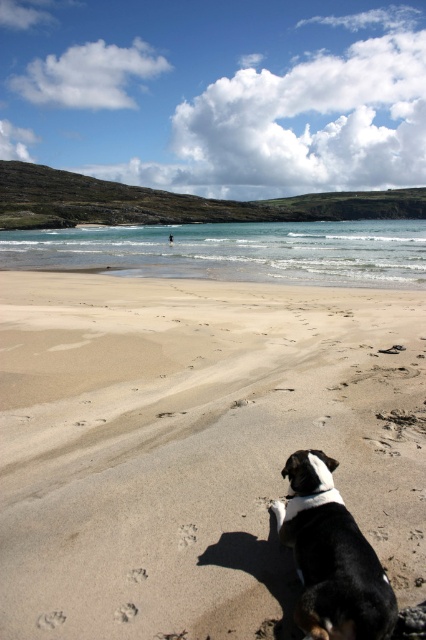
Question: Is sandy beach at lower center below black and white fur at lower right?

Choices:
 (A) no
 (B) yes

Answer: (A)

Question: Is sandy beach at lower center to the right of black and white fur at lower right from the viewer's perspective?

Choices:
 (A) yes
 (B) no

Answer: (B)

Question: Which of the following is the farthest from the observer?

Choices:
 (A) click(359, 596)
 (B) click(19, 436)

Answer: (B)

Question: From the image, what is the correct spatial relationship of sandy beach at lower center in relation to black and white fur at lower right?

Choices:
 (A) above
 (B) below

Answer: (A)

Question: Which point is closer to the camera?

Choices:
 (A) (319, 616)
 (B) (311, 340)

Answer: (A)